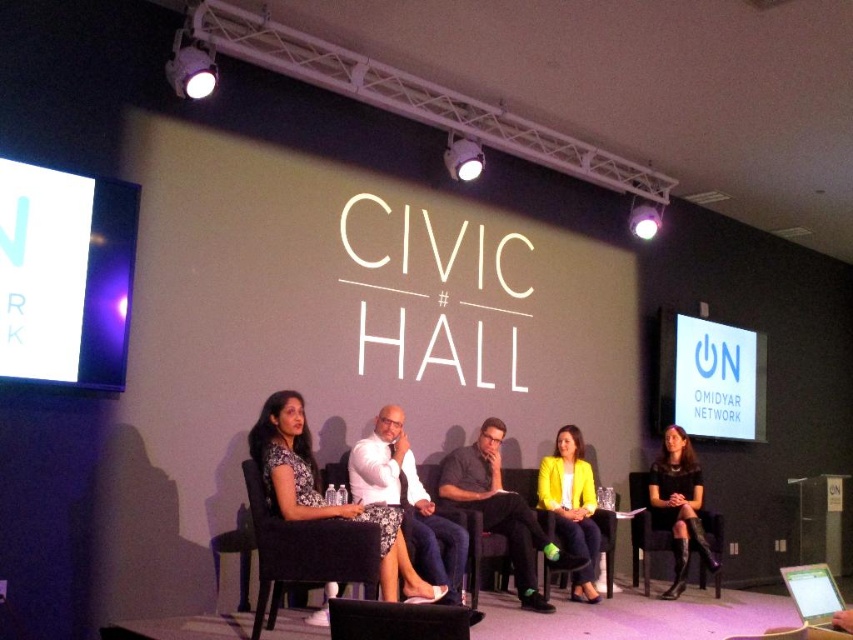
You are a photographer at the event and need to adjust the camera focus to capture both the matte black dress at center and the yellow matte blazer at center clearly. Since the two items are at the same distance from the camera, which one would require a larger aperture setting to ensure both are in focus?

The matte black dress at center is larger in size than the yellow matte blazer at center. To ensure both are in focus, you should set the aperture to accommodate the larger size of the matte black dress at center, but aperture settings primarily affect depth of field, not object size. Proper focus adjustment, not aperture, would be needed here.

You are organizing a photoshoot and need to place a narrow decorative item between the yellow matte blazer at center and the black leather chair at lower right. Which object should the item be placed closer to?

The narrow decorative item should be placed closer to the yellow matte blazer at center because it is thinner than the black leather chair at lower right.

You are standing at the camera position and want to reach the point at coordinate point (405, 602). Can you walk directly to it without moving around any obstacles?

The point at coordinate point (405, 602) is 11.30 feet away from the camera position. Since there are no obstacles mentioned in the scene description, you can walk directly to it without needing to move around any obstacles.